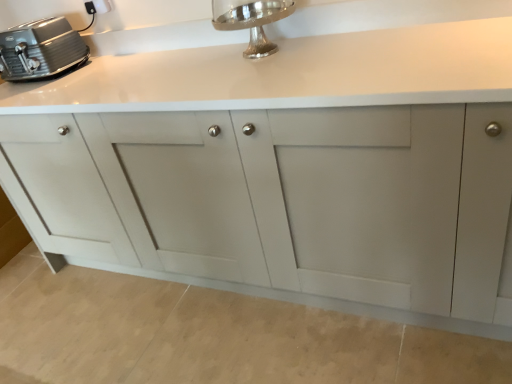
Question: Considering the relative sizes of matte gray cabinet at center and silver polished faucet at upper center in the image provided, is matte gray cabinet at center smaller than silver polished faucet at upper center?

Choices:
 (A) no
 (B) yes

Answer: (A)

Question: Can you confirm if matte gray cabinet at center is bigger than silver polished faucet at upper center?

Choices:
 (A) no
 (B) yes

Answer: (B)

Question: From the image's perspective, is matte gray cabinet at center located beneath silver polished faucet at upper center?

Choices:
 (A) no
 (B) yes

Answer: (B)

Question: Is the position of matte gray cabinet at center more distant than that of silver polished faucet at upper center?

Choices:
 (A) no
 (B) yes

Answer: (A)

Question: Is matte gray cabinet at center oriented towards silver polished faucet at upper center?

Choices:
 (A) no
 (B) yes

Answer: (A)

Question: In the image, is satin silver toaster at upper left positioned in front of or behind white plastic electric outlet at upper left?

Choices:
 (A) behind
 (B) front

Answer: (B)

Question: Based on their sizes in the image, would you say satin silver toaster at upper left is bigger or smaller than white plastic electric outlet at upper left?

Choices:
 (A) small
 (B) big

Answer: (B)

Question: From the image's perspective, is satin silver toaster at upper left positioned above or below white plastic electric outlet at upper left?

Choices:
 (A) above
 (B) below

Answer: (B)

Question: In terms of height, does satin silver toaster at upper left look taller or shorter compared to white plastic electric outlet at upper left?

Choices:
 (A) short
 (B) tall

Answer: (B)

Question: From the image's perspective, is satin silver toaster at upper left positioned above or below matte gray cabinet at center?

Choices:
 (A) above
 (B) below

Answer: (A)

Question: Would you say satin silver toaster at upper left is inside or outside matte gray cabinet at center?

Choices:
 (A) outside
 (B) inside

Answer: (B)

Question: Does point (54, 66) appear closer or farther from the camera than point (114, 180)?

Choices:
 (A) farther
 (B) closer

Answer: (A)

Question: Considering the positions of satin silver toaster at upper left and matte gray cabinet at center in the image, is satin silver toaster at upper left bigger or smaller than matte gray cabinet at center?

Choices:
 (A) big
 (B) small

Answer: (B)

Question: Considering the relative positions of matte gray cabinet at center and white plastic electric outlet at upper left in the image provided, is matte gray cabinet at center to the left or to the right of white plastic electric outlet at upper left?

Choices:
 (A) right
 (B) left

Answer: (A)

Question: Based on their sizes in the image, would you say matte gray cabinet at center is bigger or smaller than white plastic electric outlet at upper left?

Choices:
 (A) small
 (B) big

Answer: (B)